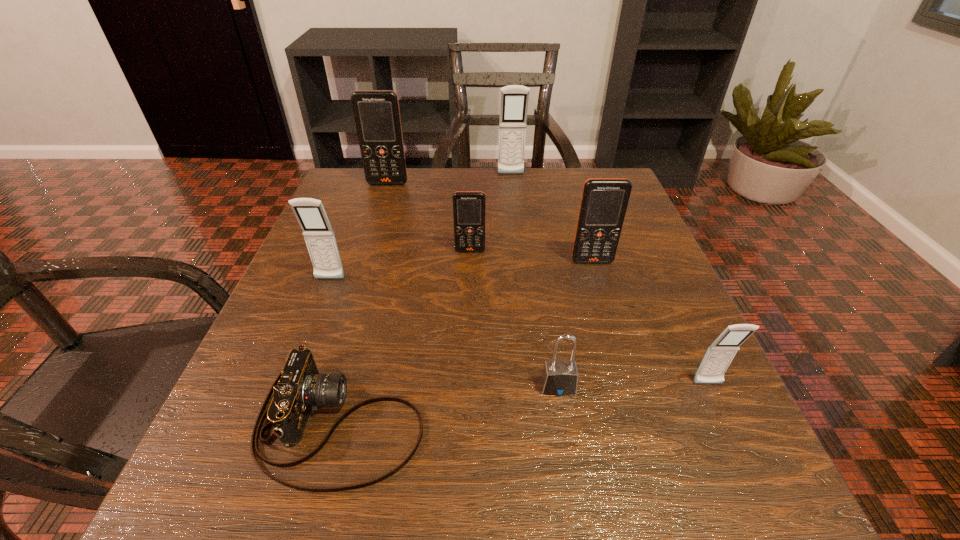
In order to click on free space located 0.380m on the screen of the smallest orange cellular telephone in this screenshot , I will do coord(466,426).

You are a GUI agent. You are given a task and a screenshot of the screen. Output one action in this format:
    pyautogui.click(x=<x>, y=<y>)
    Task: Click on the vacant space located 0.080m on the front-facing side of the rightmost gray cellular telephone
    The height and width of the screenshot is (540, 960).
    Given the screenshot: What is the action you would take?
    pyautogui.click(x=734, y=441)

I want to click on free space located 0.150m on the shackle of the second shortest object, so click(577, 506).

The width and height of the screenshot is (960, 540). Find the location of `vacant space located 0.380m on the front-facing side of the camera`. vacant space located 0.380m on the front-facing side of the camera is located at coordinates (704, 423).

Find the location of a particular element. This screenshot has height=540, width=960. object that is at the near edge is located at coordinates (301, 388).

In order to click on camera that is at the left edge in this screenshot , I will do `click(301, 388)`.

Find the location of a particular element. object located in the far left corner section of the desktop is located at coordinates (377, 115).

This screenshot has height=540, width=960. What are the coordinates of `object positioned at the near left corner` in the screenshot? It's located at (301, 388).

Where is `free region at the far edge`? free region at the far edge is located at coordinates (527, 197).

You are a GUI agent. You are given a task and a screenshot of the screen. Output one action in this format:
    pyautogui.click(x=<x>, y=<y>)
    Task: Click on the vacant region at the near edge of the desktop
    The image size is (960, 540).
    Given the screenshot: What is the action you would take?
    pyautogui.click(x=634, y=515)